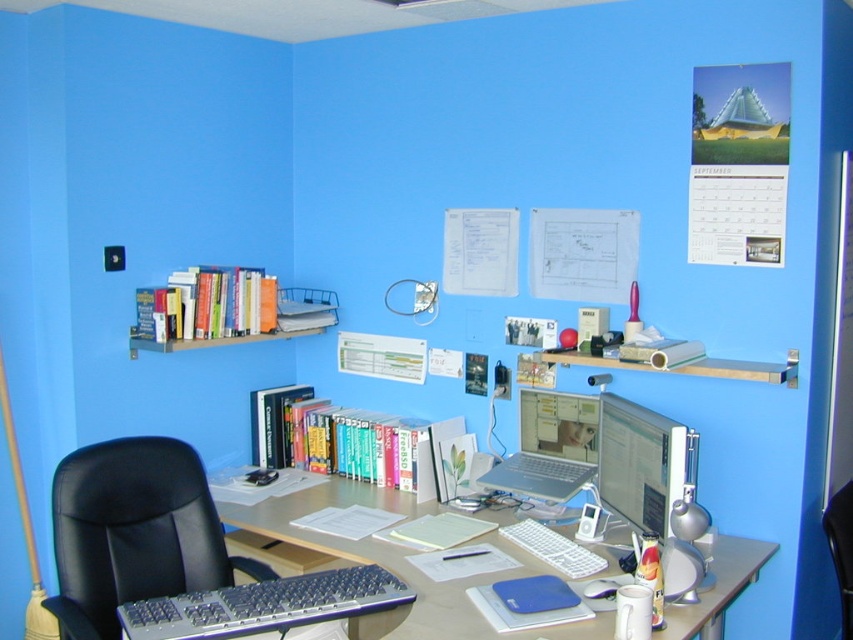
Between hardcover books at center and hardcover books at upper left, which one appears on the left side from the viewer's perspective?

Positioned to the left is hardcover books at upper left.

Between point (389, 461) and point (236, 282), which one is positioned behind?

The point (236, 282) is behind.

Locate an element on the screen. hardcover books at center is located at coordinates (332, 436).

Between point (123, 483) and point (358, 428), which one is positioned behind?

Point (358, 428)

At what (x,y) coordinates should I click in order to perform the action: click on black leather swivel chair at left. Please return your answer as a coordinate pair (x, y). Image resolution: width=853 pixels, height=640 pixels. Looking at the image, I should click on (132, 532).

Can you confirm if hardcover books at center is thinner than silver metallic laptop at center?

Incorrect, hardcover books at center's width is not less than silver metallic laptop at center's.

Who is more distant from viewer, (387, 433) or (520, 461)?

Positioned behind is point (387, 433).

The width and height of the screenshot is (853, 640). What are the coordinates of `hardcover books at center` in the screenshot? It's located at (332, 436).